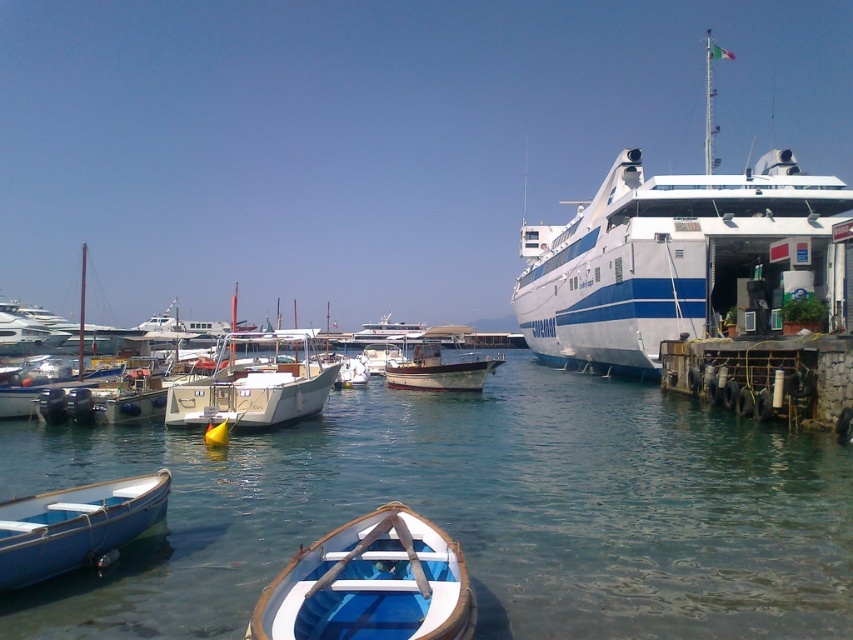
Question: Which object is farther from the camera taking this photo?

Choices:
 (A) blue painted wood boat at lower left
 (B) blue wooden boat at center
 (C) wooden polished boat at center

Answer: (C)

Question: Is blue wooden boat at center closer to camera compared to wooden polished boat at center?

Choices:
 (A) no
 (B) yes

Answer: (B)

Question: Is clear blue water at center closer to camera compared to white glossy cruise ship at right?

Choices:
 (A) no
 (B) yes

Answer: (B)

Question: Which of these objects is positioned closest to the wooden polished boat at center?

Choices:
 (A) blue wooden boat at center
 (B) clear blue water at center

Answer: (B)

Question: Which point is closer to the camera?

Choices:
 (A) (567, 256)
 (B) (476, 385)
 (C) (73, 493)
 (D) (355, 557)

Answer: (D)

Question: Does clear blue water at center have a larger size compared to blue painted wood boat at lower left?

Choices:
 (A) yes
 (B) no

Answer: (A)